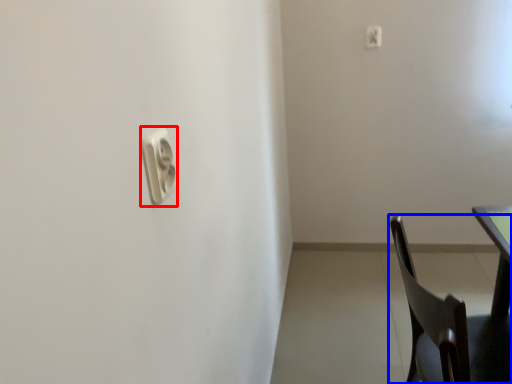
Question: Which of the following is the closest to the observer, light switch (highlighted by a red box) or chair (highlighted by a blue box)?

Choices:
 (A) light switch
 (B) chair

Answer: (A)